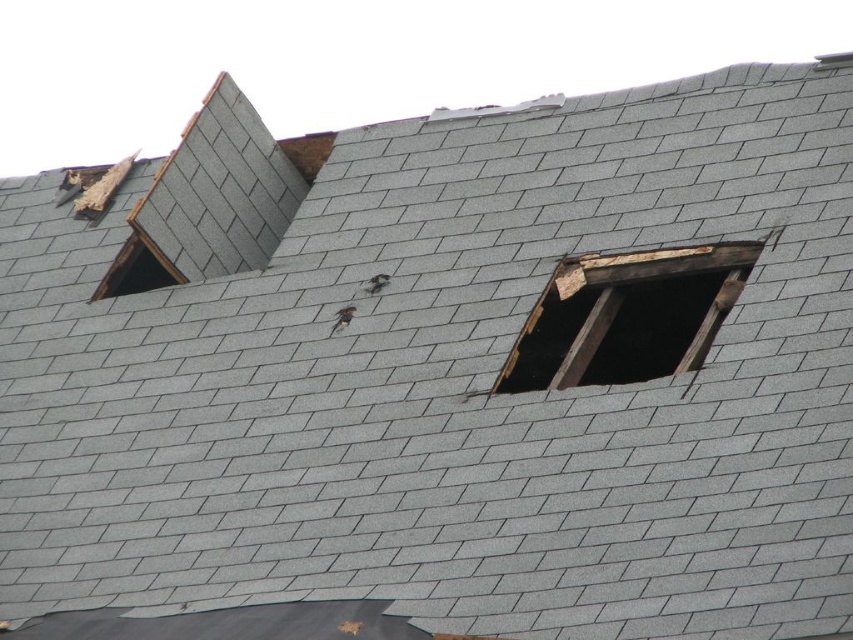
You are a window installer assessing the roof. You need to replace the transparent glass window at upper left and the weathered wood window at upper right. Which window should you approach first if you want to start from the left side of the roof?

You should approach the transparent glass window at upper left first because it is located to the left of the weathered wood window at upper right.

You are a contractor assessing the roof damage. You notice the weathered wood window at upper right and the transparent glass window at upper left. Which window is closer to the roof surface?

The weathered wood window at upper right is positioned under the transparent glass window at upper left, meaning it is closer to the roof surface.